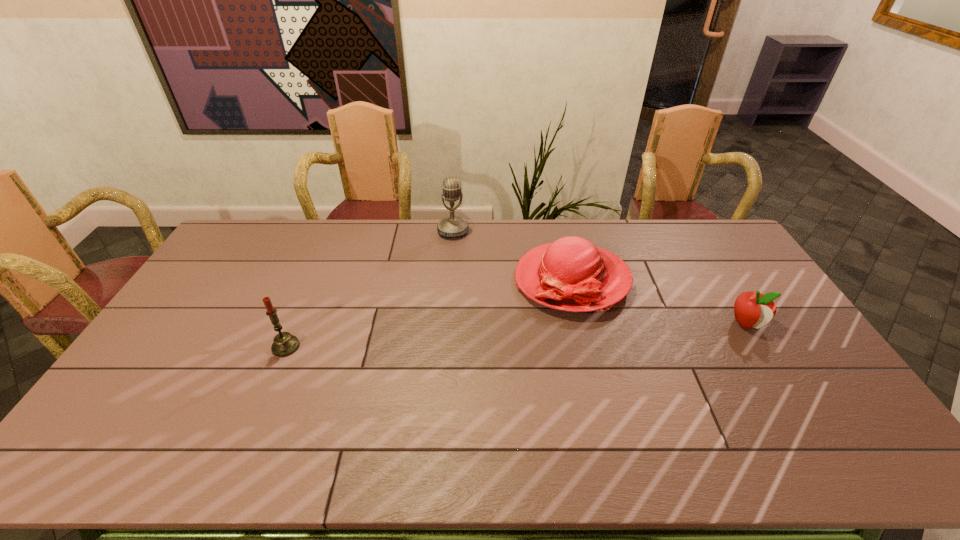
You are a GUI agent. You are given a task and a screenshot of the screen. Output one action in this format:
    pyautogui.click(x=<x>, y=<y>)
    Task: Click on the object that is the closest one to the tallest object
    The width and height of the screenshot is (960, 540).
    Given the screenshot: What is the action you would take?
    pyautogui.click(x=571, y=274)

Where is `free spot that satisfies the following two spatial constraints: 1. on the back side of the candle; 2. on the left side of the second object from left to right`? free spot that satisfies the following two spatial constraints: 1. on the back side of the candle; 2. on the left side of the second object from left to right is located at coordinates (335, 231).